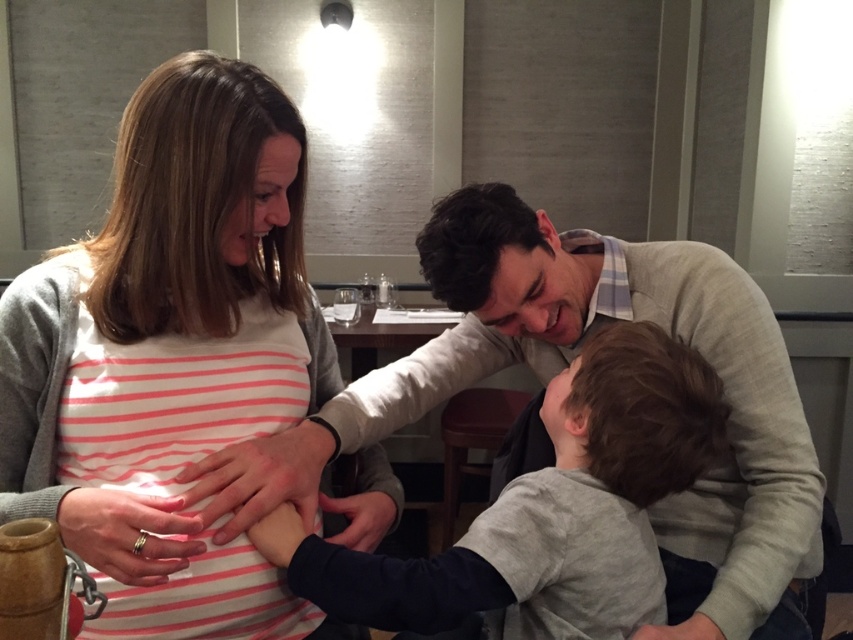
Does gray cotton shirt at center appear over matte skin hand at center?

No.

Can you confirm if gray cotton shirt at center is bigger than matte skin hand at center?

Yes.

Where is `gray cotton shirt at center`? This screenshot has height=640, width=853. gray cotton shirt at center is located at coordinates (546, 509).

You are a GUI agent. You are given a task and a screenshot of the screen. Output one action in this format:
    pyautogui.click(x=<x>, y=<y>)
    Task: Click on the gray cotton shirt at center
    Image resolution: width=853 pixels, height=640 pixels.
    Given the screenshot: What is the action you would take?
    pyautogui.click(x=546, y=509)

Who is positioned more to the right, pink striped shirt at center or silver metallic ring at center?

From the viewer's perspective, pink striped shirt at center appears more on the right side.

Who is taller, pink striped shirt at center or silver metallic ring at center?

Standing taller between the two is pink striped shirt at center.

Is point (200, 51) positioned behind point (144, 580)?

Yes.

Find the location of a particular element. The image size is (853, 640). pink striped shirt at center is located at coordinates (170, 355).

Is pink striped shirt at center further to camera compared to matte black hand at center?

No, it is in front of matte black hand at center.

Can you confirm if pink striped shirt at center is shorter than matte black hand at center?

No.

Does point (248, 552) come in front of point (331, 536)?

Yes, point (248, 552) is in front of point (331, 536).

Where is `pink striped shirt at center`? The height and width of the screenshot is (640, 853). pink striped shirt at center is located at coordinates (170, 355).